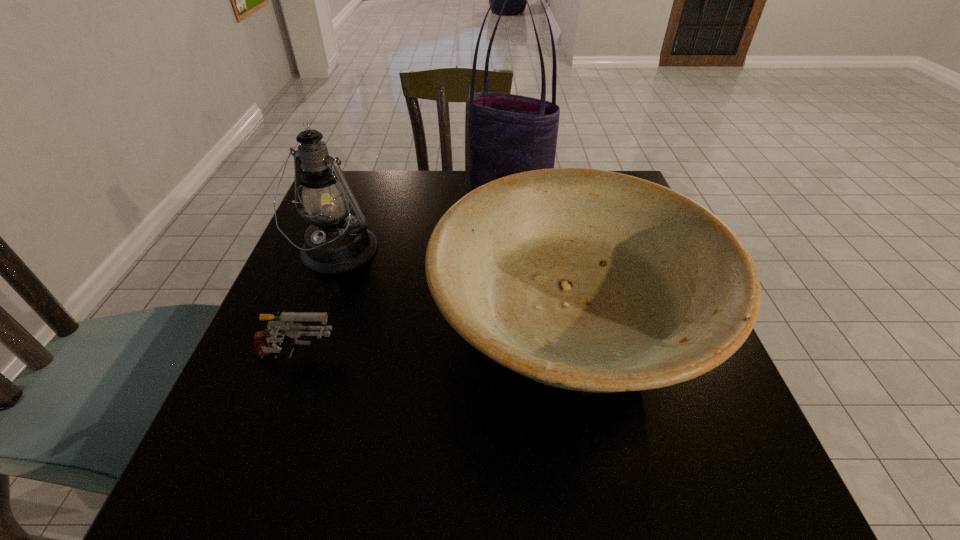
Locate an element on the screen. The image size is (960, 540). object at the near edge is located at coordinates pyautogui.click(x=589, y=280).

Where is `oil lamp that is at the left edge`? The image size is (960, 540). oil lamp that is at the left edge is located at coordinates (336, 242).

I want to click on gun at the left edge, so click(284, 323).

Locate an element on the screen. The height and width of the screenshot is (540, 960). object located in the right edge section of the desktop is located at coordinates (589, 280).

Where is `object that is at the near right corner`? The image size is (960, 540). object that is at the near right corner is located at coordinates (589, 280).

Identify the location of free region at the far edge of the desktop. The width and height of the screenshot is (960, 540). (396, 174).

This screenshot has width=960, height=540. In order to click on free space at the near edge of the desktop in this screenshot , I will do `click(355, 490)`.

Where is `vacant space at the left edge`? vacant space at the left edge is located at coordinates (326, 365).

Identify the location of free spot between the dish and the shortest object. The width and height of the screenshot is (960, 540). (432, 346).

Where is `vacant area between the farthest object and the oil lamp`? vacant area between the farthest object and the oil lamp is located at coordinates (422, 224).